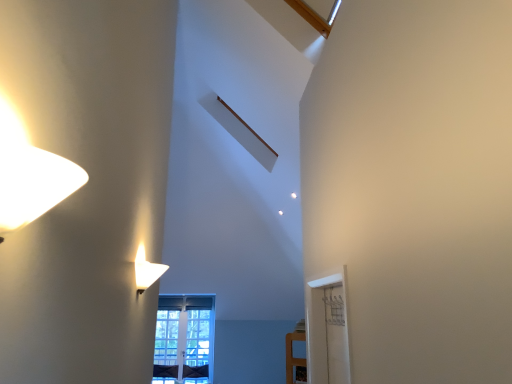
Question: From the image's perspective, is matte white lampshade at upper left located above or below clear glass window at center?

Choices:
 (A) below
 (B) above

Answer: (B)

Question: Is matte white lampshade at upper left taller or shorter than clear glass window at center?

Choices:
 (A) short
 (B) tall

Answer: (A)

Question: In the image, is matte white lampshade at upper left positioned in front of or behind clear glass window at center?

Choices:
 (A) front
 (B) behind

Answer: (A)

Question: From the image's perspective, is clear glass window at center positioned above or below matte white lampshade at upper left?

Choices:
 (A) above
 (B) below

Answer: (B)

Question: Is clear glass window at center in front of or behind matte white lampshade at upper left in the image?

Choices:
 (A) behind
 (B) front

Answer: (A)

Question: Would you say clear glass window at center is inside or outside matte white lampshade at upper left?

Choices:
 (A) outside
 (B) inside

Answer: (A)

Question: From a real-world perspective, is clear glass window at center positioned above or below matte white lampshade at upper left?

Choices:
 (A) below
 (B) above

Answer: (A)